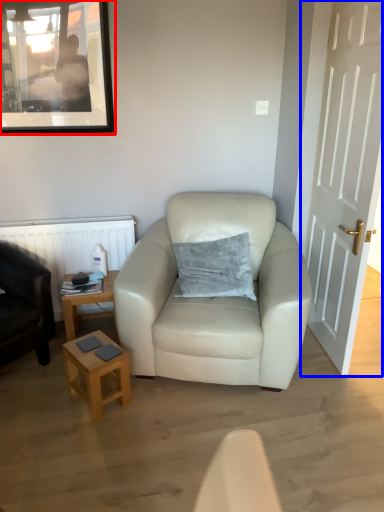
Question: Which object appears closest to the camera in this image, picture frame (highlighted by a red box) or door (highlighted by a blue box)?

Choices:
 (A) picture frame
 (B) door

Answer: (B)